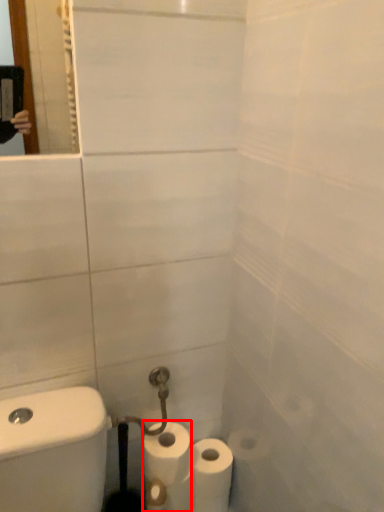
Question: Observing the image, what is the correct spatial positioning of toilet paper (annotated by the red box) in reference to toilet paper?

Choices:
 (A) left
 (B) right

Answer: (A)